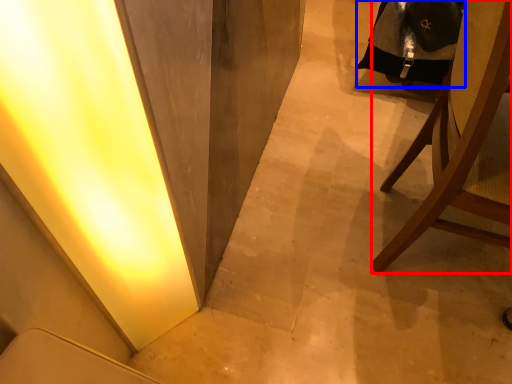
Question: Which object appears farthest to the camera in this image, chair (highlighted by a red box) or robe (highlighted by a blue box)?

Choices:
 (A) chair
 (B) robe

Answer: (B)